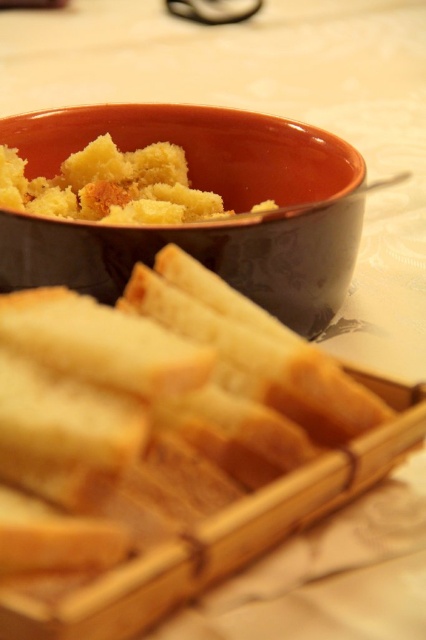
You are a food stylist arranging items on a table. You have a matte ceramic bowl at upper center and a yellow crumbly bread at center. Based on the scene, where should you place a new decorative plate so it is between these two items?

The matte ceramic bowl at upper center is below the yellow crumbly bread at center, so placing the decorative plate between them would require positioning it above the matte ceramic bowl at upper center and below the yellow crumbly bread at center.

In the scene shown: You are arranging items on a table and need to place a new item between the wooden bread basket and the matte ceramic bowl at upper center. Based on their positions, which object is closer to the center of the table?

The matte ceramic bowl at upper center is closer to the center of the table than the wooden bread basket, so placing the new item between them would require positioning it near the matte ceramic bowl at upper center.

In the scene shown: You are looking at the table with the bread basket and ceramic bowl. There are two points marked on the tablecloth at coordinates point (x=296, y=264) and point (x=88, y=173). Which point is closer to you?

Point (x=296, y=264) is closer to the viewer than point (x=88, y=173).